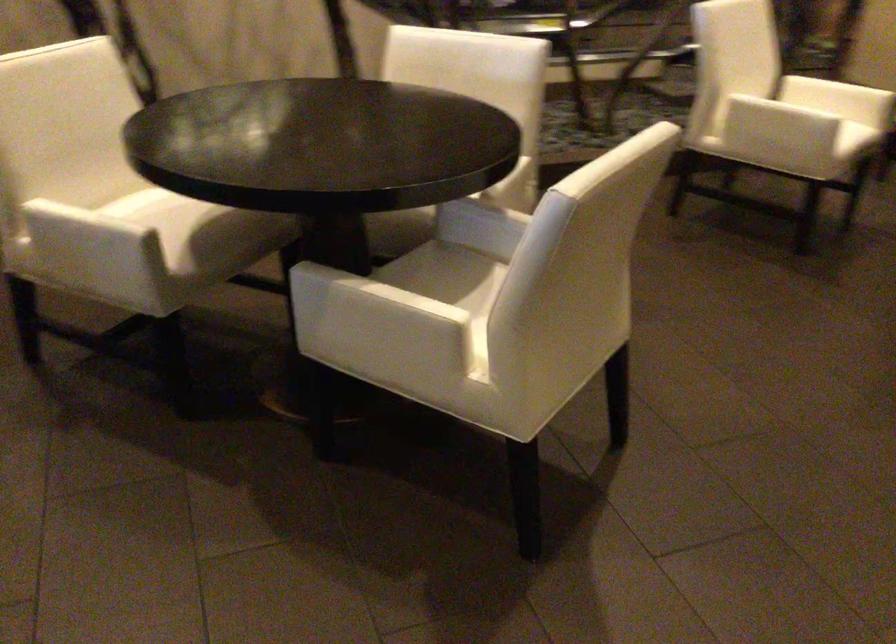
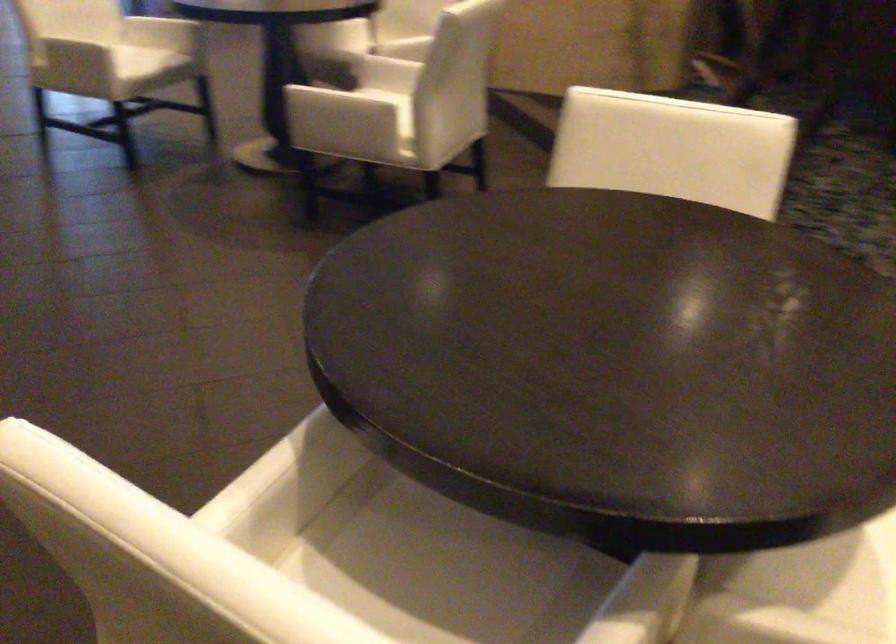
The point at [512,210] is marked in the first image. Where is the corresponding point in the second image?

(616, 630)